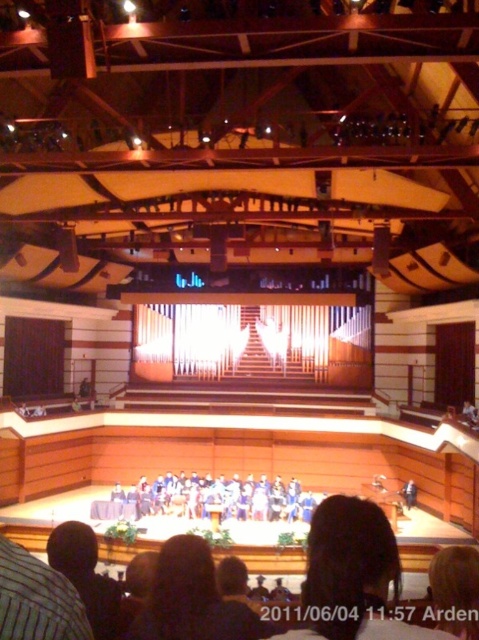
You are an event planner arranging a photo shoot in the auditorium. You need to position a large camera setup to capture both the blue fabric chairs at center and the black fabric at lower left. Based on their positions, which object should be placed closer to the camera to ensure both are in frame without moving the camera?

The black fabric at lower left should be placed closer to the camera since the blue fabric chairs at center are to the right of the black fabric at lower left, meaning the chairs are further away. Positioning the black fabric closer ensures both are within the frame without needing to adjust the camera position.

In the scene shown: You are an event organizer planning to place a large banner between the blue fabric chairs at center and the black fabric at lower left. Which object should the banner be placed closer to if you want it to be more visible to the audience seated in the front rows?

The banner should be placed closer to the blue fabric chairs at center because they are larger in size than the black fabric at lower left, making them a more prominent focal point for the audience.